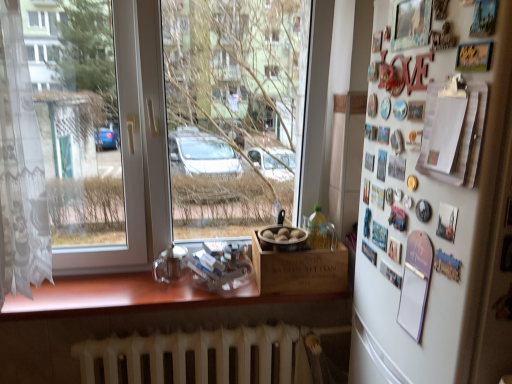
Image resolution: width=512 pixels, height=384 pixels. In order to click on wooden at lower center in this screenshot , I will do pos(135,296).

Describe the element at coordinates (135, 296) in the screenshot. This screenshot has width=512, height=384. I see `wooden at lower center` at that location.

You are a GUI agent. You are given a task and a screenshot of the screen. Output one action in this format:
    pyautogui.click(x=<x>, y=<y>)
    Task: Click on the white metallic radiator at lower center
    The image size is (512, 384).
    Given the screenshot: What is the action you would take?
    pyautogui.click(x=199, y=357)

Image resolution: width=512 pixels, height=384 pixels. In order to click on transparent glass window at center in this screenshot , I will do 130,223.

Would you say wooden box at center contains wooden at lower center?

Definitely not — wooden at lower center is not inside wooden box at center.

Considering the sizes of objects wooden box at center and wooden at lower center in the image provided, who is shorter, wooden box at center or wooden at lower center?

wooden at lower center is shorter.

Does point (254, 255) appear closer or farther from the camera than point (321, 293)?

Point (254, 255) appears to be farther away from the viewer than point (321, 293).

Based on the photo, between wooden box at center and wooden at lower center, which one has smaller width?

wooden box at center.

Is wooden at lower center with white matte refrigerator at right?

wooden at lower center is not next to white matte refrigerator at right, and they're not touching.

Is wooden at lower center wider or thinner than white matte refrigerator at right?

wooden at lower center is thinner than white matte refrigerator at right.

Could you tell me if wooden at lower center is turned towards white matte refrigerator at right?

No.

From the image's perspective, is wooden at lower center positioned above or below white matte refrigerator at right?

Based on their image positions, wooden at lower center is located beneath white matte refrigerator at right.

Between white metallic radiator at lower center and wooden at lower center, which one has larger width?

wooden at lower center is wider.

Which object is further away from the camera, white metallic radiator at lower center or wooden at lower center?

Positioned behind is white metallic radiator at lower center.

From a real-world perspective, which is physically above, white metallic radiator at lower center or wooden at lower center?

wooden at lower center is physically above.

Is white metallic radiator at lower center taller than wooden at lower center?

Yes.

Is wooden box at center directly adjacent to white metallic radiator at lower center?

No, wooden box at center is not next to white metallic radiator at lower center.

From their relative heights in the image, would you say wooden box at center is taller or shorter than white metallic radiator at lower center?

Clearly, wooden box at center is shorter compared to white metallic radiator at lower center.

Is wooden box at center to the right of white metallic radiator at lower center from the viewer's perspective?

Yes, wooden box at center is to the right of white metallic radiator at lower center.

From the image's perspective, which object appears higher, white metallic radiator at lower center or wooden box at center?

wooden box at center appears higher in the image.

Is white metallic radiator at lower center spatially inside wooden box at center, or outside of it?

white metallic radiator at lower center is not enclosed by wooden box at center.

Consider the image. From the image's perspective, would you say wooden at lower center is shown under wooden box at center?

Yes.

Where is `box on the right side of wooden at lower center`? Image resolution: width=512 pixels, height=384 pixels. box on the right side of wooden at lower center is located at coordinates (298, 269).

Would you say wooden at lower center is to the left or to the right of wooden box at center in the picture?

wooden at lower center is to the left of wooden box at center.

Is wooden at lower center oriented towards wooden box at center?

No, wooden at lower center is not facing towards wooden box at center.

Considering the sizes of transparent glass window at center and white metallic radiator at lower center in the image, is transparent glass window at center bigger or smaller than white metallic radiator at lower center?

Considering their sizes, transparent glass window at center takes up more space than white metallic radiator at lower center.

From a real-world perspective, relative to white metallic radiator at lower center, is transparent glass window at center vertically above or below?

Clearly, from a real-world perspective, transparent glass window at center is above white metallic radiator at lower center.

Which object is more forward, transparent glass window at center or white metallic radiator at lower center?

transparent glass window at center is in front.

You are a GUI agent. You are given a task and a screenshot of the screen. Output one action in this format:
    pyautogui.click(x=<x>, y=<y>)
    Task: Click on the window above the white metallic radiator at lower center (from the image's perspective)
    This screenshot has height=384, width=512.
    Given the screenshot: What is the action you would take?
    pyautogui.click(x=130, y=223)

Locate an element on the screen. counter top in front of the wooden box at center is located at coordinates (135, 296).

Image resolution: width=512 pixels, height=384 pixels. What are the coordinates of `counter top below the white matte refrigerator at right (from the image's perspective)` in the screenshot? It's located at (135, 296).

Which object lies further to the anchor point white matte refrigerator at right, wooden box at center or white metallic radiator at lower center?

white metallic radiator at lower center is positioned further to the anchor white matte refrigerator at right.

Based on their spatial positions, is white matte refrigerator at right or wooden box at center further from transparent glass window at center?

Result: white matte refrigerator at right.

Considering their positions, is wooden box at center positioned further to white metallic radiator at lower center than white matte refrigerator at right?

white matte refrigerator at right.

From the image, which object appears to be nearer to white matte refrigerator at right, white metallic radiator at lower center or wooden at lower center?

The object closer to white matte refrigerator at right is wooden at lower center.

Looking at the image, which one is located further to white matte refrigerator at right, white metallic radiator at lower center or transparent glass window at center?

transparent glass window at center is further to white matte refrigerator at right.

Looking at the image, which one is located closer to white matte refrigerator at right, wooden box at center or transparent glass window at center?

wooden box at center.

Looking at the image, which one is located closer to wooden at lower center, white metallic radiator at lower center or wooden box at center?

The object closer to wooden at lower center is white metallic radiator at lower center.

Based on their spatial positions, is wooden box at center or white metallic radiator at lower center closer to wooden at lower center?

white metallic radiator at lower center is closer to wooden at lower center.

The height and width of the screenshot is (384, 512). Identify the location of radiator located between wooden at lower center and white matte refrigerator at right in the left-right direction. (199, 357).

Where is `window between wooden at lower center and white matte refrigerator at right in the horizontal direction`? window between wooden at lower center and white matte refrigerator at right in the horizontal direction is located at coordinates (130, 223).

The width and height of the screenshot is (512, 384). In order to click on box between transparent glass window at center and white metallic radiator at lower center in the vertical direction in this screenshot , I will do `click(298, 269)`.

You are a GUI agent. You are given a task and a screenshot of the screen. Output one action in this format:
    pyautogui.click(x=<x>, y=<y>)
    Task: Click on the radiator between transparent glass window at center and white matte refrigerator at right
    The width and height of the screenshot is (512, 384).
    Given the screenshot: What is the action you would take?
    pyautogui.click(x=199, y=357)